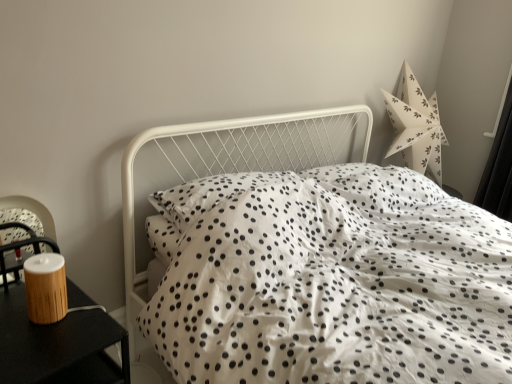
The image size is (512, 384). What do you see at coordinates (317, 262) in the screenshot?
I see `white dotted fabric at center` at bounding box center [317, 262].

Locate an element on the screen. This screenshot has width=512, height=384. wooden nightstand at left is located at coordinates (58, 346).

Locate an element on the screen. white dotted fabric at center is located at coordinates coord(317,262).

Does wooden nightstand at left touch black matte curtain at right?

No, wooden nightstand at left is not next to black matte curtain at right.

Considering their positions, is wooden nightstand at left located in front of or behind black matte curtain at right?

Clearly, wooden nightstand at left is in front of black matte curtain at right.

From the image's perspective, is wooden nightstand at left located above black matte curtain at right?

No, from the image's perspective, wooden nightstand at left is not above black matte curtain at right.

Considering their positions, is black matte curtain at right located in front of or behind wooden nightstand at left?

Visually, black matte curtain at right is located behind wooden nightstand at left.

Looking at their sizes, would you say black matte curtain at right is wider or thinner than wooden nightstand at left?

Considering their sizes, black matte curtain at right looks slimmer than wooden nightstand at left.

From the image's perspective, who appears lower, black matte curtain at right or wooden nightstand at left?

wooden nightstand at left, from the image's perspective.

From a real-world perspective, which object stands above the other?

In real-world perspective, black matte curtain at right is above.

Would you say black matte curtain at right is part of white dotted fabric at center's contents?

Definitely not — black matte curtain at right is not inside white dotted fabric at center.

Which of these two, white dotted fabric at center or black matte curtain at right, stands taller?

black matte curtain at right.

Based on the photo, from the image's perspective, between white dotted fabric at center and black matte curtain at right, who is located below?

From the image's view, white dotted fabric at center is below.

Is white dotted fabric at center behind black matte curtain at right?

No, white dotted fabric at center is closer to the viewer.

Which is less distant, (88, 362) or (223, 312)?

Point (88, 362) is positioned closer to the camera compared to point (223, 312).

From the picture: From the image's perspective, is wooden nightstand at left on top of white dotted fabric at center?

Actually, wooden nightstand at left appears below white dotted fabric at center in the image.

You are a GUI agent. You are given a task and a screenshot of the screen. Output one action in this format:
    pyautogui.click(x=<x>, y=<y>)
    Task: Click on the nightstand below the white dotted fabric at center (from a real-world perspective)
    The image size is (512, 384).
    Given the screenshot: What is the action you would take?
    pyautogui.click(x=58, y=346)

Is wooden nightstand at left surrounding white dotted fabric at center?

No.

This screenshot has width=512, height=384. In the image, there is a white dotted fabric at center. What are the coordinates of `nightstand below it (from a real-world perspective)` in the screenshot? It's located at (58, 346).

Which is more distant, [367,250] or [125,358]?

The point [367,250] is behind.

How different are the orientations of white dotted fabric at center and wooden nightstand at left in degrees?

The angle between the facing direction of white dotted fabric at center and the facing direction of wooden nightstand at left is 2.98 degrees.

From the image's perspective, which one is positioned lower, black matte curtain at right or white dotted fabric at center?

white dotted fabric at center is shown below in the image.

Can you confirm if black matte curtain at right is taller than white dotted fabric at center?

Yes.

In the scene shown: Does black matte curtain at right turn towards white dotted fabric at center?

Yes.

Is point (508, 87) closer to camera compared to point (173, 314)?

No.

Where is `curtain that is behind the wooden nightstand at left`? curtain that is behind the wooden nightstand at left is located at coordinates (499, 165).

Locate an element on the screen. The height and width of the screenshot is (384, 512). nightstand in front of the black matte curtain at right is located at coordinates (58, 346).

Looking at the image, which one is located closer to wooden nightstand at left, white dotted fabric at center or black matte curtain at right?

white dotted fabric at center is closer to wooden nightstand at left.

Considering their positions, is black matte curtain at right positioned closer to white dotted fabric at center than wooden nightstand at left?

wooden nightstand at left is closer to white dotted fabric at center.

Considering their positions, is black matte curtain at right positioned further to wooden nightstand at left than white dotted fabric at center?

Among the two, black matte curtain at right is located further to wooden nightstand at left.

Based on their spatial positions, is wooden nightstand at left or white dotted fabric at center further from black matte curtain at right?

wooden nightstand at left.

In the scene shown: When comparing their distances from white dotted fabric at center, does wooden nightstand at left or black matte curtain at right seem closer?

Based on the image, wooden nightstand at left appears to be nearer to white dotted fabric at center.

Considering their positions, is white dotted fabric at center positioned closer to black matte curtain at right than wooden nightstand at left?

white dotted fabric at center is positioned closer to the anchor black matte curtain at right.

Identify the location of bed located between wooden nightstand at left and black matte curtain at right in the left-right direction. This screenshot has height=384, width=512. (317, 262).